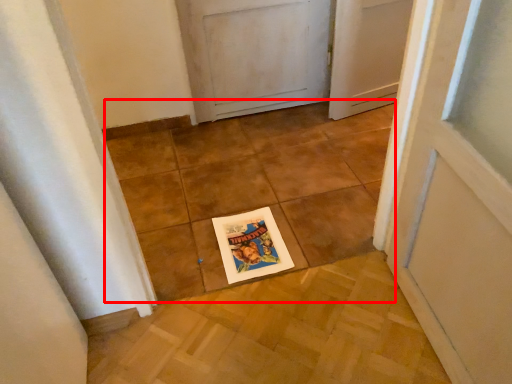
Question: From the image's perspective, considering the relative positions of tile (annotated by the red box) and postcard in the image provided, where is tile (annotated by the red box) located with respect to the staircase?

Choices:
 (A) below
 (B) above

Answer: (B)